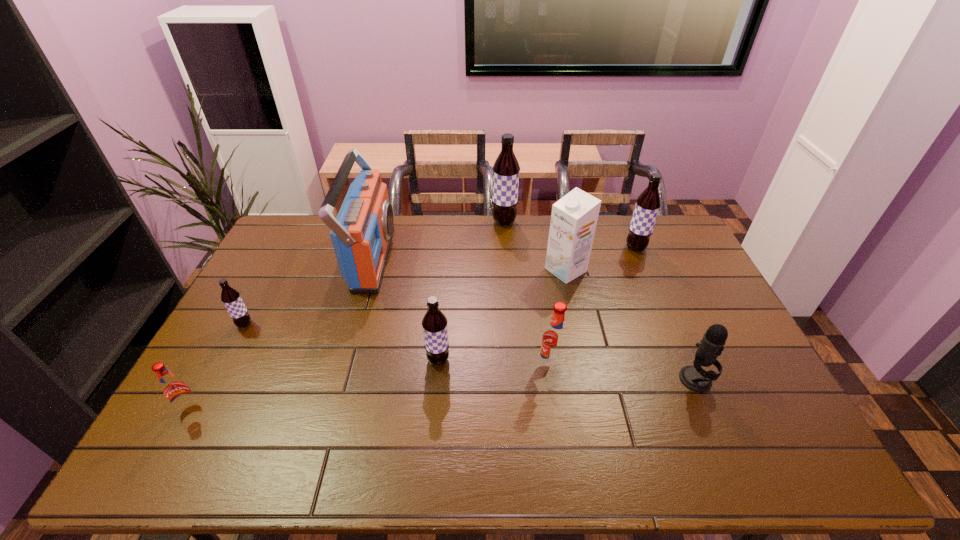
Where is `blank space at the left edge of the desktop`? This screenshot has height=540, width=960. blank space at the left edge of the desktop is located at coordinates (266, 339).

Identify the location of free space at the right edge of the desktop. The width and height of the screenshot is (960, 540). (721, 395).

In the image, there is a desktop. At what (x,y) coordinates should I click in order to perform the action: click on vacant space at the near right corner. Please return your answer as a coordinate pair (x, y). Looking at the image, I should click on (734, 443).

The height and width of the screenshot is (540, 960). Find the location of `empty location between the tallest root beer and the right red root beer`. empty location between the tallest root beer and the right red root beer is located at coordinates point(527,294).

Locate an element on the screen. This screenshot has height=540, width=960. free spot between the fifth shortest root beer and the second nearest brown root beer is located at coordinates (440, 286).

This screenshot has height=540, width=960. Find the location of `empty location between the rightmost brown root beer and the blue radio receiver`. empty location between the rightmost brown root beer and the blue radio receiver is located at coordinates (504, 253).

Locate an element on the screen. Image resolution: width=960 pixels, height=540 pixels. vacant area between the second brown root beer from left to right and the nearest root beer is located at coordinates (314, 384).

I want to click on vacant region between the farthest brown root beer and the black microphone, so click(600, 301).

Locate an element on the screen. The image size is (960, 540). vacant area that lies between the third biggest brown root beer and the leftmost brown root beer is located at coordinates (342, 342).

Identify which object is the second closest to the third root beer from left to right. Please provide its 2D coordinates. Your answer should be formatted as a tuple, i.e. [(x, y)], where the tuple contains the x and y coordinates of a point satisfying the conditions above.

[(361, 234)]